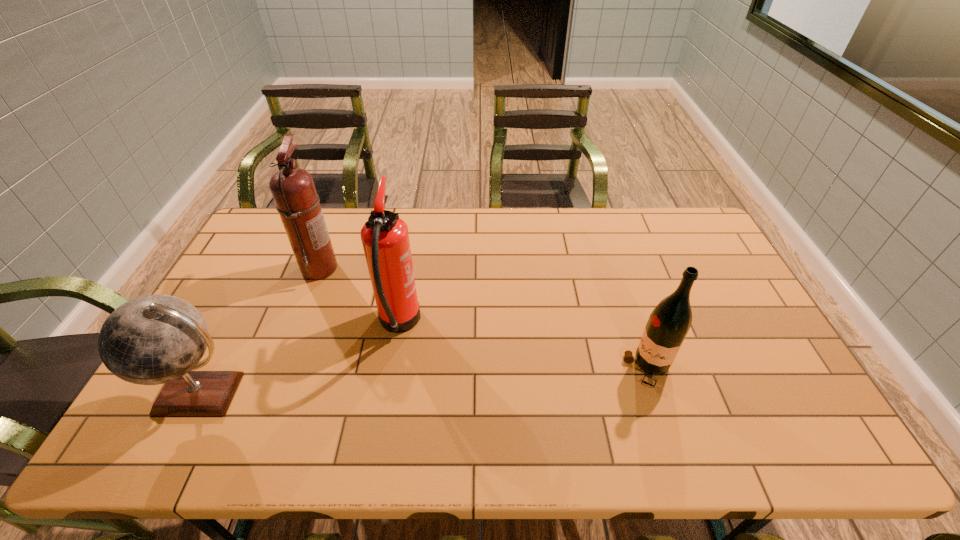
At what (x,y) coordinates should I click in order to perform the action: click on empty space that is in between the left fire extinguisher and the globe. Please return your answer as a coordinate pair (x, y). This screenshot has height=540, width=960. Looking at the image, I should click on (261, 330).

Locate an element on the screen. This screenshot has width=960, height=540. vacant area that lies between the farthest object and the rightmost object is located at coordinates (484, 318).

Where is `free space between the second object from left to right and the rightmost object`? free space between the second object from left to right and the rightmost object is located at coordinates (484, 318).

Find the location of a particular element. The height and width of the screenshot is (540, 960). empty location between the farthest object and the rightmost object is located at coordinates click(x=484, y=318).

Identify the location of blank region between the farther fire extinguisher and the nearer fire extinguisher. The width and height of the screenshot is (960, 540). (359, 296).

Find the location of a particular element. This screenshot has height=540, width=960. free spot between the nearer fire extinguisher and the globe is located at coordinates (x=300, y=359).

You are a GUI agent. You are given a task and a screenshot of the screen. Output one action in this format:
    pyautogui.click(x=<x>, y=<y>)
    Task: Click on the vacant area between the rightmost object and the farthest object
    The width and height of the screenshot is (960, 540).
    Given the screenshot: What is the action you would take?
    pyautogui.click(x=484, y=318)

Select which object appears as the third closest to the rightmost object. Please provide its 2D coordinates. Your answer should be formatted as a tuple, i.e. [(x, y)], where the tuple contains the x and y coordinates of a point satisfying the conditions above.

[(154, 339)]

Choose which object is the third nearest neighbor to the second object from right to left. Please provide its 2D coordinates. Your answer should be formatted as a tuple, i.e. [(x, y)], where the tuple contains the x and y coordinates of a point satisfying the conditions above.

[(668, 324)]

Locate an element on the screen. The height and width of the screenshot is (540, 960). vacant space that satisfies the following two spatial constraints: 1. on the front-facing side of the farthest object; 2. on the left side of the wine bottle is located at coordinates (281, 369).